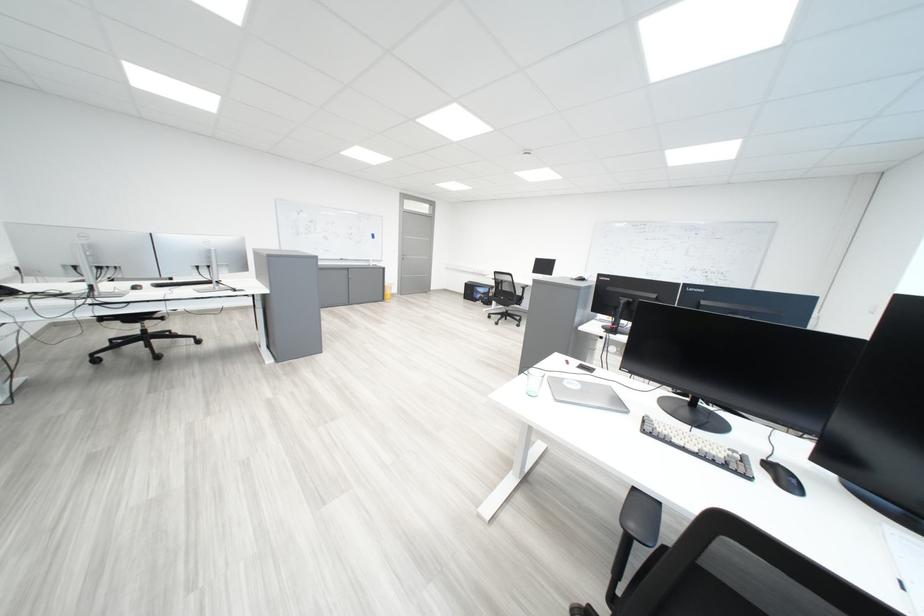
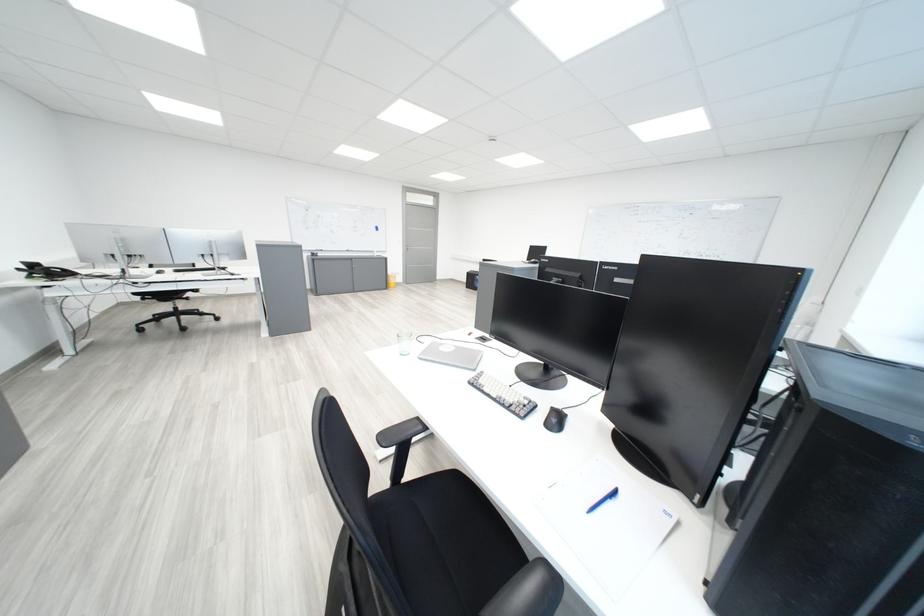
The point at (416,260) is marked in the first image. Where is the corresponding point in the second image?

(419, 251)